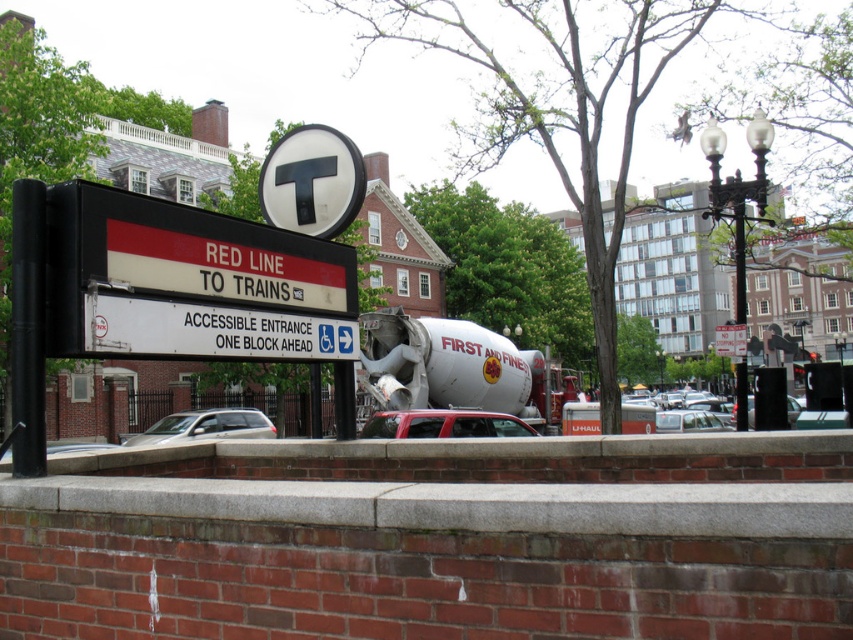
Does metallic silver car at center have a larger size compared to matte silver car at lower left?

No.

Who is taller, metallic silver car at center or matte silver car at lower left?

With more height is matte silver car at lower left.

Measure the distance between point (694, 413) and camera.

Point (694, 413) and camera are 26.67 meters apart.

You are a GUI agent. You are given a task and a screenshot of the screen. Output one action in this format:
    pyautogui.click(x=<x>, y=<y>)
    Task: Click on the metallic silver car at center
    
    Given the screenshot: What is the action you would take?
    pyautogui.click(x=688, y=420)

This screenshot has height=640, width=853. Describe the element at coordinates (206, 426) in the screenshot. I see `satin silver car at center` at that location.

Between satin silver car at center and matte silver car at lower left, which one has less height?

satin silver car at center

Is point (225, 417) farther from viewer compared to point (53, 444)?

Yes, it is behind point (53, 444).

At what (x,y) coordinates should I click in order to perform the action: click on satin silver car at center. Please return your answer as a coordinate pair (x, y). This screenshot has width=853, height=640. Looking at the image, I should click on (206, 426).

Can you confirm if satin silver car at center is positioned to the left of white plastic sign at upper center?

Correct, you'll find satin silver car at center to the left of white plastic sign at upper center.

Can you confirm if satin silver car at center is bigger than white plastic sign at upper center?

Correct, satin silver car at center is larger in size than white plastic sign at upper center.

Which is behind, point (218, 436) or point (727, 333)?

The point (218, 436) is behind.

This screenshot has height=640, width=853. Identify the location of satin silver car at center. (206, 426).